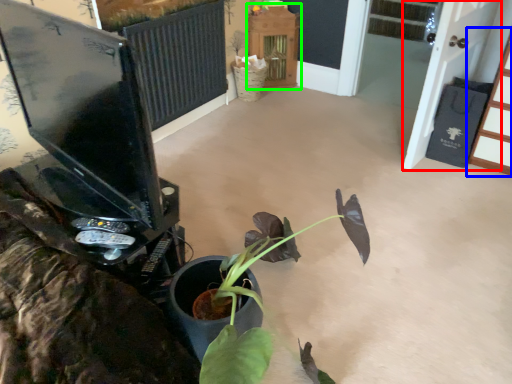
Question: Estimate the real-world distances between objects in this image. Which object is farther from screen door (highlighted by a red box), furniture (highlighted by a blue box) or furniture (highlighted by a green box)?

Choices:
 (A) furniture
 (B) furniture

Answer: (B)